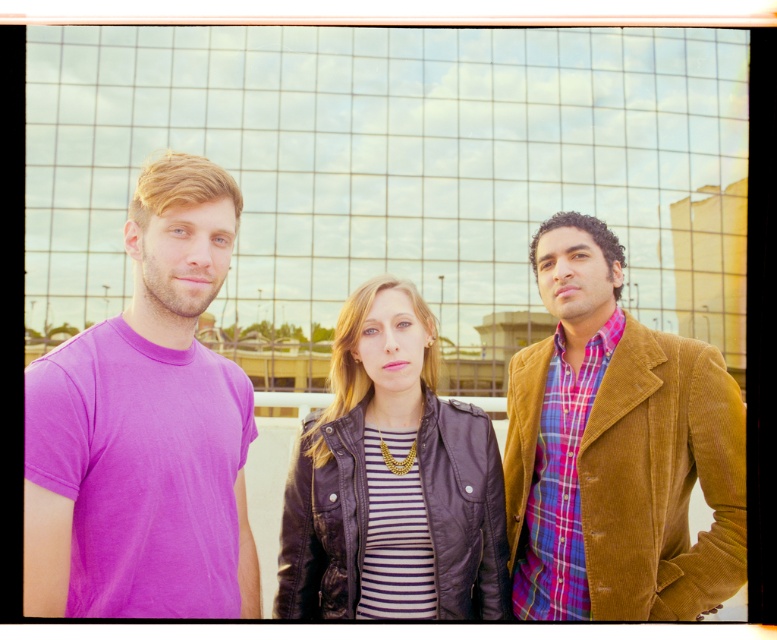
Which is above, purple cotton t-shirt at left or leather jacket at center?

purple cotton t-shirt at left is higher up.

Does purple cotton t-shirt at left have a smaller size compared to leather jacket at center?

Actually, purple cotton t-shirt at left might be larger than leather jacket at center.

What do you see at coordinates (145, 429) in the screenshot? This screenshot has width=777, height=640. I see `purple cotton t-shirt at left` at bounding box center [145, 429].

Locate an element on the screen. purple cotton t-shirt at left is located at coordinates (145, 429).

Which of these two, corduroy jacket at right or leather jacket at center, stands taller?

Standing taller between the two is corduroy jacket at right.

Is point (570, 544) positioned before point (395, 468)?

That is False.

You are a GUI agent. You are given a task and a screenshot of the screen. Output one action in this format:
    pyautogui.click(x=<x>, y=<y>)
    Task: Click on the corduroy jacket at right
    
    Given the screenshot: What is the action you would take?
    pyautogui.click(x=615, y=451)

Who is positioned more to the left, purple cotton t-shirt at left or corduroy jacket at right?

purple cotton t-shirt at left is more to the left.

Does purple cotton t-shirt at left have a greater width compared to corduroy jacket at right?

No.

Does point (23, 522) lie in front of point (639, 518)?

Yes, it is.

Find the location of `purple cotton t-shirt at left`. purple cotton t-shirt at left is located at coordinates (145, 429).